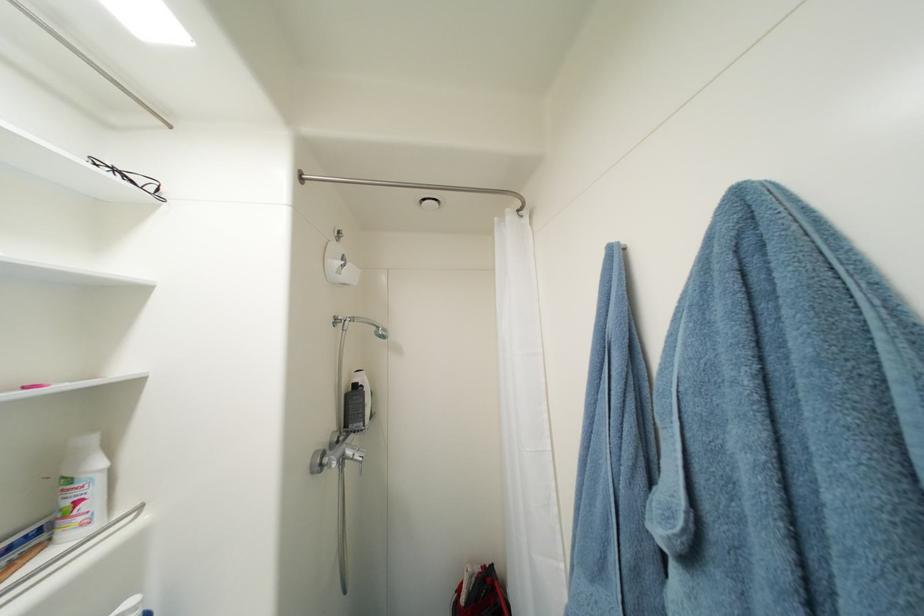
Locate an element on the screen. Image resolution: width=924 pixels, height=616 pixels. black shampoo bottle is located at coordinates (354, 408).